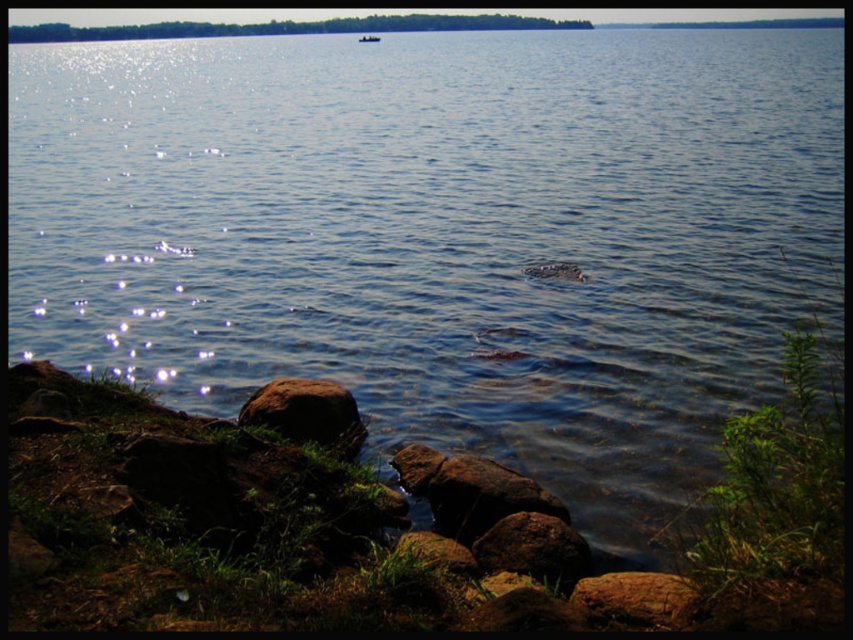
Looking at this image, you are standing at the lakeside and want to walk from point [281,435] to point [473,550]. Which direction should you move relative to your current position?

You should move backward because point [281,435] is closer to you than point [473,550], so to reach it you need to move away from your current position towards the lake.

You are standing on the lakeside and see the brown rough rock at lower center and the brown rough rock at lower right. Which rock is closer to the water?

The brown rough rock at lower center is closer to the water because it is positioned below the brown rough rock at lower right.